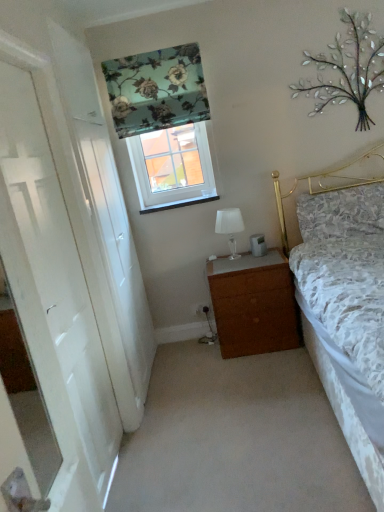
What do you see at coordinates (230, 227) in the screenshot? I see `white glass table lamp at center` at bounding box center [230, 227].

The width and height of the screenshot is (384, 512). What do you see at coordinates (347, 69) in the screenshot? I see `metallic silver tree at upper right` at bounding box center [347, 69].

This screenshot has height=512, width=384. What do you see at coordinates (254, 304) in the screenshot?
I see `brown wood chest of drawers at center` at bounding box center [254, 304].

The image size is (384, 512). Find the location of `white glossy door at left`. white glossy door at left is located at coordinates (105, 233).

Locate an element on the screen. floral fabric pillow at upper right is located at coordinates (342, 213).

This screenshot has width=384, height=512. Describe the element at coordinates (156, 90) in the screenshot. I see `floral fabric curtain at upper center` at that location.

This screenshot has height=512, width=384. In order to click on white glass table lamp at center in this screenshot , I will do `click(230, 227)`.

From a real-world perspective, is white glossy door at left located higher than white plastic window at upper center?

No.

From the image's perspective, who appears lower, white glossy door at left or white plastic window at upper center?

white glossy door at left, from the image's perspective.

Is white glossy door at left bigger than white plastic window at upper center?

Yes, white glossy door at left is bigger than white plastic window at upper center.

Would you say white glass table lamp at center is a long distance from white glossy door at left?

white glass table lamp at center is positioned a significant distance from white glossy door at left.

How different are the orientations of white glass table lamp at center and white glossy door at left in degrees?

90.6 degrees.

Which is more to the left, white glass table lamp at center or white glossy door at left?

Positioned to the left is white glossy door at left.

In terms of width, does white glass table lamp at center look wider or thinner when compared to white glossy door at left?

white glass table lamp at center is wider than white glossy door at left.

Would you say floral fabric curtain at upper center is inside or outside white glass table lamp at center?

floral fabric curtain at upper center is located beyond the bounds of white glass table lamp at center.

The width and height of the screenshot is (384, 512). In the image, there is a floral fabric curtain at upper center. Identify the location of table lamp below it (from a real-world perspective). (230, 227).

Can you confirm if floral fabric curtain at upper center is smaller than white glass table lamp at center?

Incorrect, floral fabric curtain at upper center is not smaller in size than white glass table lamp at center.

Between floral fabric curtain at upper center and white glass table lamp at center, which one has smaller width?

With smaller width is floral fabric curtain at upper center.

Considering the relative sizes of metallic silver tree at upper right and white glossy door at left in the image provided, is metallic silver tree at upper right taller than white glossy door at left?

In fact, metallic silver tree at upper right may be shorter than white glossy door at left.

Is the surface of metallic silver tree at upper right in direct contact with white glossy door at left?

No.

In order to click on screen door below the metallic silver tree at upper right (from a real-world perspective) in this screenshot , I will do `click(105, 233)`.

Is point (369, 120) farther from viewer compared to point (110, 277)?

Yes, point (369, 120) is behind point (110, 277).

Is brown wood chest of drawers at center not close to floral fabric pillow at upper right?

No, there isn't a large distance between brown wood chest of drawers at center and floral fabric pillow at upper right.

Considering the positions of point (294, 314) and point (368, 226), is point (294, 314) closer or farther from the camera than point (368, 226)?

Point (294, 314) is farther from the camera than point (368, 226).

Can you confirm if brown wood chest of drawers at center is taller than floral fabric pillow at upper right?

Indeed, brown wood chest of drawers at center has a greater height compared to floral fabric pillow at upper right.

What's the angular difference between floral fabric curtain at upper center and floral fabric pillow at upper right's facing directions?

The angle between the facing direction of floral fabric curtain at upper center and the facing direction of floral fabric pillow at upper right is 0.245 degrees.

Relative to floral fabric pillow at upper right, is floral fabric curtain at upper center in front or behind?

Clearly, floral fabric curtain at upper center is in front of floral fabric pillow at upper right.

From a real-world perspective, is floral fabric curtain at upper center physically above floral fabric pillow at upper right?

Indeed, from a real-world perspective, floral fabric curtain at upper center stands above floral fabric pillow at upper right.

Is floral fabric curtain at upper center positioned with its back to floral fabric pillow at upper right?

No.

Considering the relative sizes of white plastic window at upper center and white glossy door at left in the image provided, is white plastic window at upper center shorter than white glossy door at left?

Correct, white plastic window at upper center is not as tall as white glossy door at left.

How many degrees apart are the facing directions of white plastic window at upper center and white glossy door at left?

white plastic window at upper center and white glossy door at left are facing 89.9 degrees away from each other.

From a real-world perspective, between white plastic window at upper center and white glossy door at left, who is vertically lower?

white glossy door at left, from a real-world perspective.

In the scene shown: Does white plastic window at upper center have a greater width compared to white glossy door at left?

Correct, the width of white plastic window at upper center exceeds that of white glossy door at left.

Where is `screen door below the white plastic window at upper center (from the image's perspective)`? The width and height of the screenshot is (384, 512). screen door below the white plastic window at upper center (from the image's perspective) is located at coordinates (105, 233).

What are the coordinates of `table lamp located behind the white glossy door at left` in the screenshot? It's located at (230, 227).

Which object lies nearer to the anchor point white glossy door at left, white glossy door at left or metallic silver tree at upper right?

white glossy door at left is closer to white glossy door at left.

Which object lies further to the anchor point floral fabric pillow at upper right, white plastic window at upper center or floral fabric curtain at upper center?

Based on the image, floral fabric curtain at upper center appears to be further to floral fabric pillow at upper right.

Considering their positions, is white glossy door at left positioned further to floral fabric pillow at upper right than white glass table lamp at center?

Among the two, white glossy door at left is located further to floral fabric pillow at upper right.

Considering their positions, is floral fabric curtain at upper center positioned closer to white glossy door at left than white glossy door at left?

white glossy door at left lies closer to white glossy door at left than the other object.

From the image, which object appears to be farther from floral fabric curtain at upper center, floral fabric pillow at upper right or white plastic window at upper center?

floral fabric pillow at upper right.

When comparing their distances from white glass table lamp at center, does metallic silver tree at upper right or floral fabric pillow at upper right seem closer?

The object closer to white glass table lamp at center is floral fabric pillow at upper right.

From the image, which object appears to be nearer to floral fabric curtain at upper center, floral fabric pillow at upper right or white glossy door at left?

Among the two, floral fabric pillow at upper right is located nearer to floral fabric curtain at upper center.

Looking at the image, which one is located closer to white glossy door at left, floral fabric curtain at upper center or white glass table lamp at center?

floral fabric curtain at upper center lies closer to white glossy door at left than the other object.

The height and width of the screenshot is (512, 384). I want to click on table lamp between white plastic window at upper center and metallic silver tree at upper right from left to right, so click(230, 227).

Locate an element on the screen. Image resolution: width=384 pixels, height=512 pixels. table lamp between white glossy door at left and brown wood chest of drawers at center from left to right is located at coordinates (230, 227).

The height and width of the screenshot is (512, 384). In order to click on screen door located between white glossy door at left and floral fabric pillow at upper right in the left-right direction in this screenshot , I will do `click(105, 233)`.

Locate an element on the screen. This screenshot has width=384, height=512. window between white glossy door at left and floral fabric pillow at upper right is located at coordinates (172, 167).